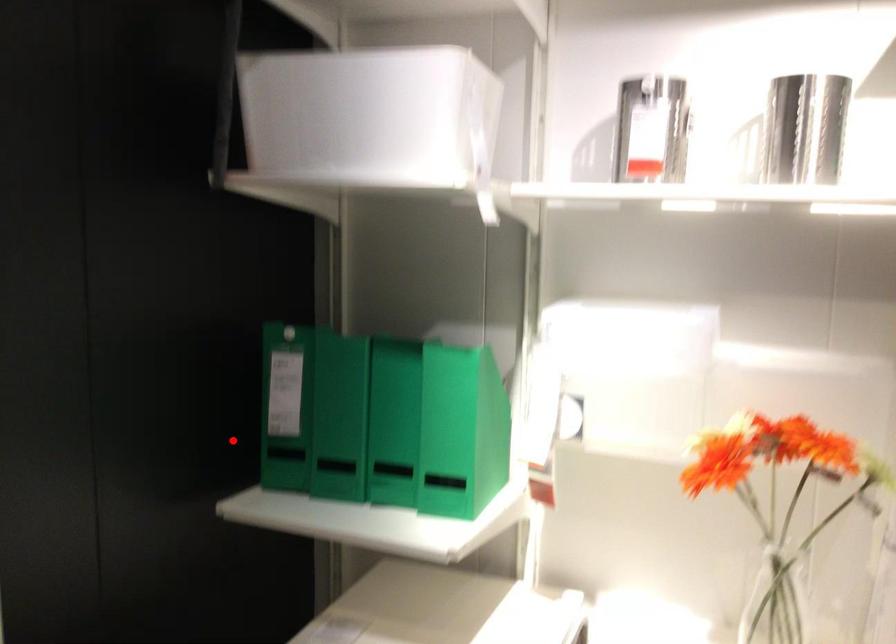
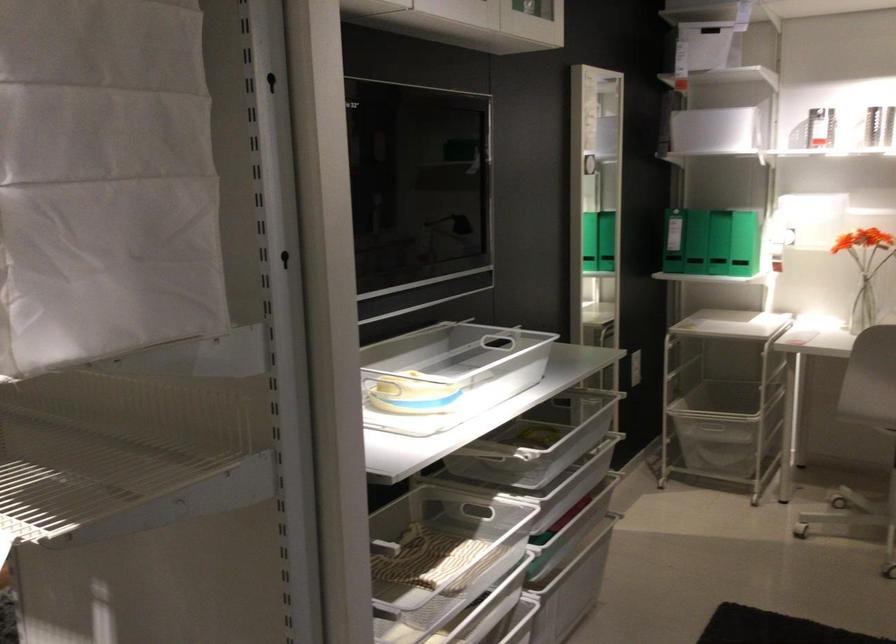
In the second image, find the point that corresponds to the highlighted location in the first image.

(673, 241)